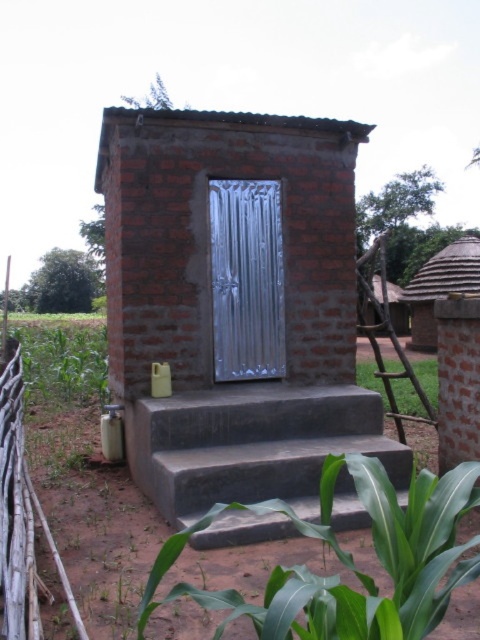
Question: Which is nearer to the thatched straw hut at center?

Choices:
 (A) green leafy plant at right
 (B) metallic silver door at center

Answer: (A)

Question: Is metallic silver door at center to the left of green leafy plant at right from the viewer's perspective?

Choices:
 (A) no
 (B) yes

Answer: (B)

Question: Which object is closer to the camera taking this photo?

Choices:
 (A) brick wall at center
 (B) wooden fence at lower left

Answer: (B)

Question: Which object appears farthest from the camera in this image?

Choices:
 (A) thatched straw hut at center
 (B) metallic silver door at center
 (C) smooth concrete stairs at center

Answer: (A)

Question: Does brick wall at center have a smaller size compared to green leafy plant at right?

Choices:
 (A) no
 (B) yes

Answer: (B)

Question: Can you confirm if brick wall at center is positioned to the right of green leafy plant at right?

Choices:
 (A) yes
 (B) no

Answer: (B)